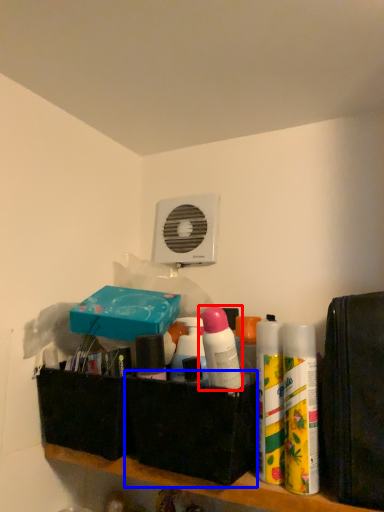
Question: Which point is further to the camera, cleaning product (highlighted by a red box) or box (highlighted by a blue box)?

Choices:
 (A) cleaning product
 (B) box

Answer: (B)